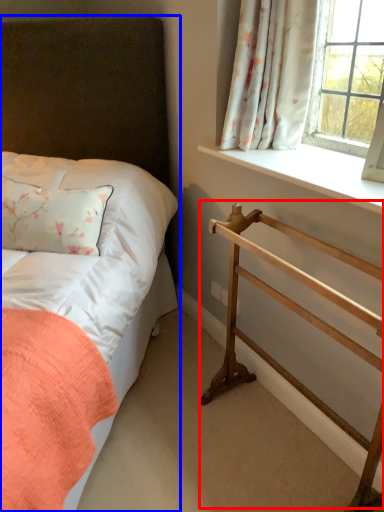
Question: Which point is closer to the camera, balustrade (highlighted by a red box) or bed (highlighted by a blue box)?

Choices:
 (A) balustrade
 (B) bed

Answer: (B)